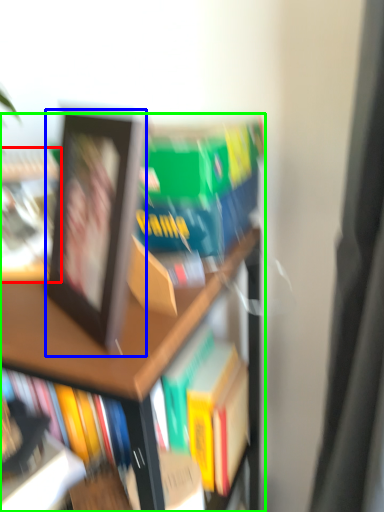
Question: Which object is positioned farthest from book (highlighted by a red box)? Select from picture frame (highlighted by a blue box) and bookcase (highlighted by a green box).

Choices:
 (A) picture frame
 (B) bookcase

Answer: (B)